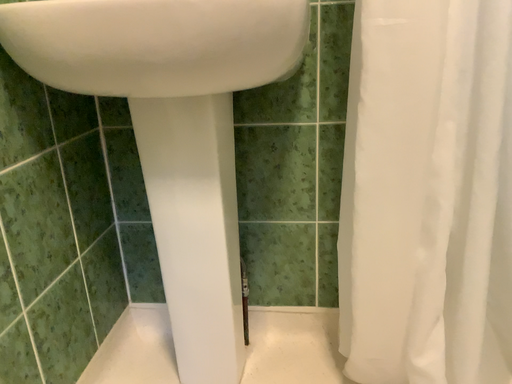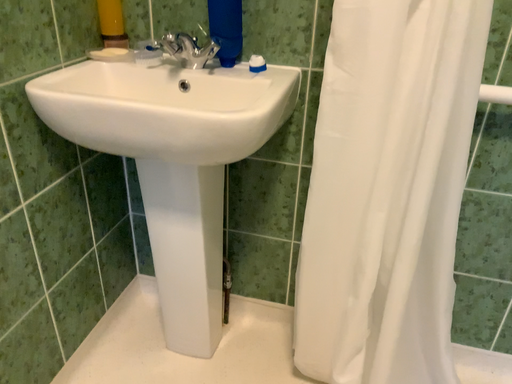
Question: Which way did the camera rotate in the video?

Choices:
 (A) rotated downward
 (B) rotated upward

Answer: (A)